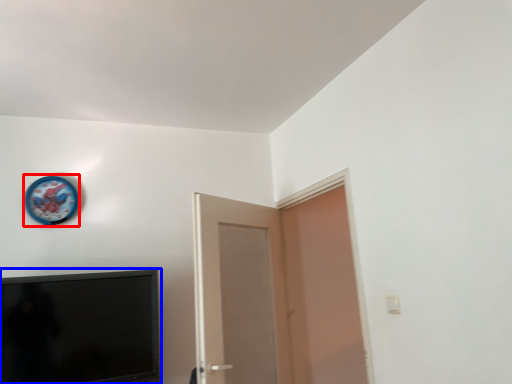
Question: Which point is further to the camera, clock (highlighted by a red box) or television (highlighted by a blue box)?

Choices:
 (A) clock
 (B) television

Answer: (A)